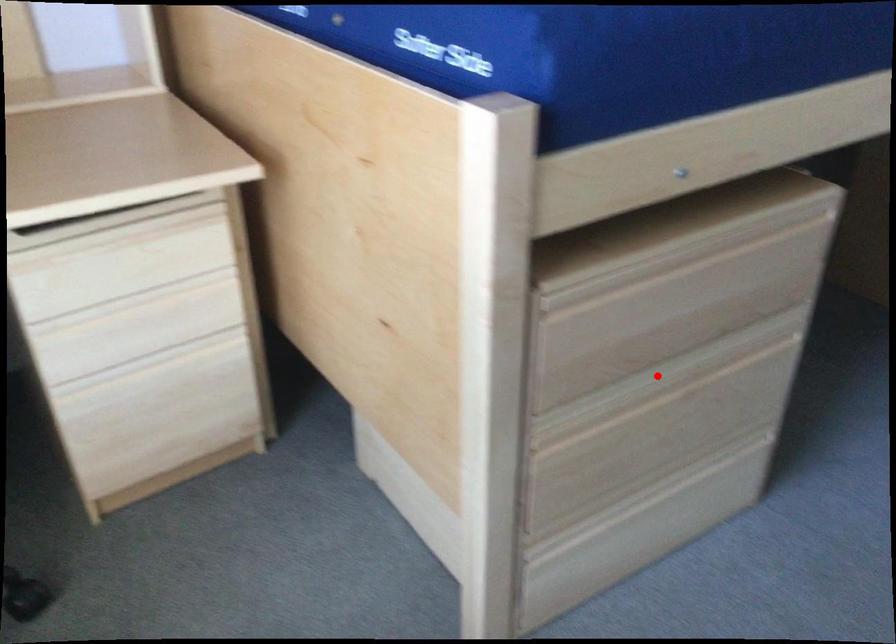
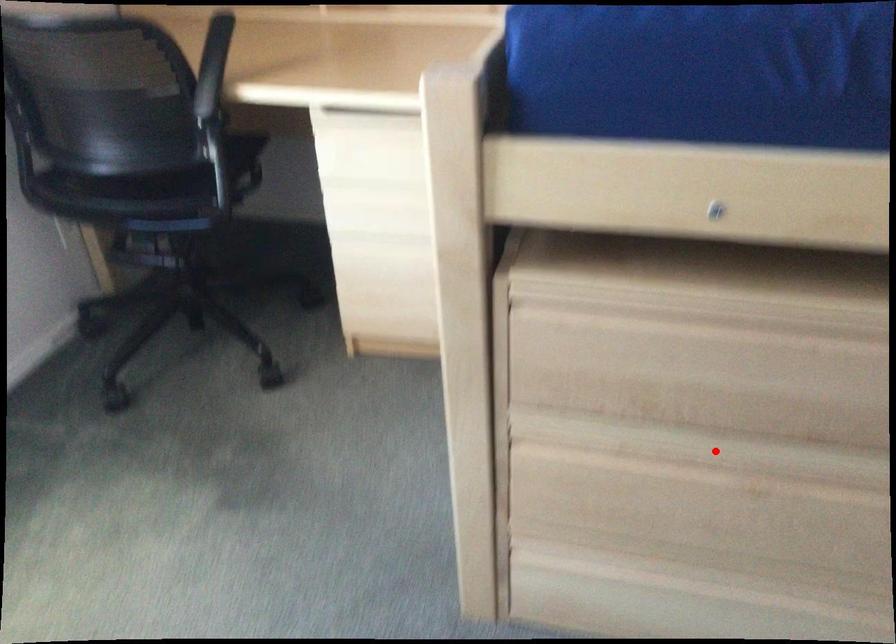
I am providing you with two images of the same scene from different viewpoints. A red point is marked on the first image and another point is marked on the second image. Do the highlighted points in image1 and image2 indicate the same real-world spot?

Yes